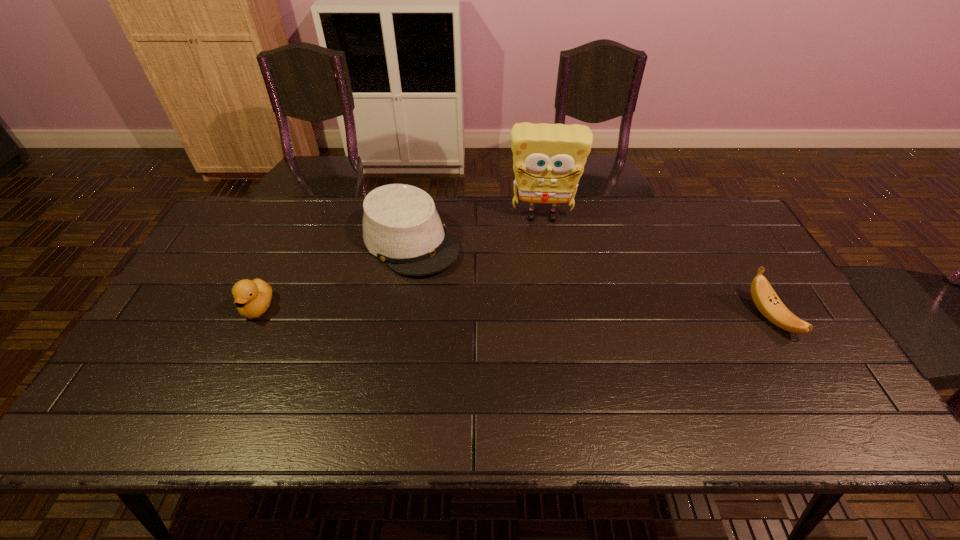
Find the location of a particular element. This screenshot has width=960, height=540. vacant space on the desktop that is between the duckling and the banana and is positioned on the front-facing side of the third object from right to left is located at coordinates (490, 312).

Where is `vacant spot on the desktop that is between the duckling and the banana and is positioned on the face of the second object from right to left`? vacant spot on the desktop that is between the duckling and the banana and is positioned on the face of the second object from right to left is located at coordinates (545, 313).